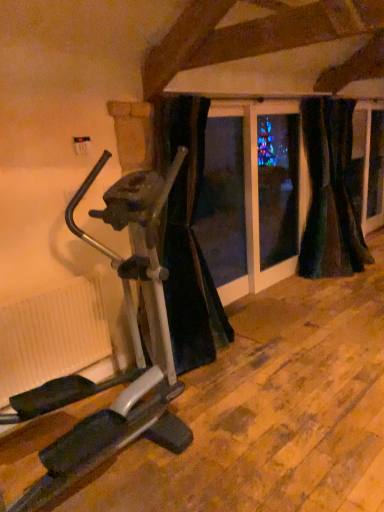
Locate an element on the screen. free space in front of black velvet curtain at center, which is the 3th curtain in right-to-left order is located at coordinates (246, 404).